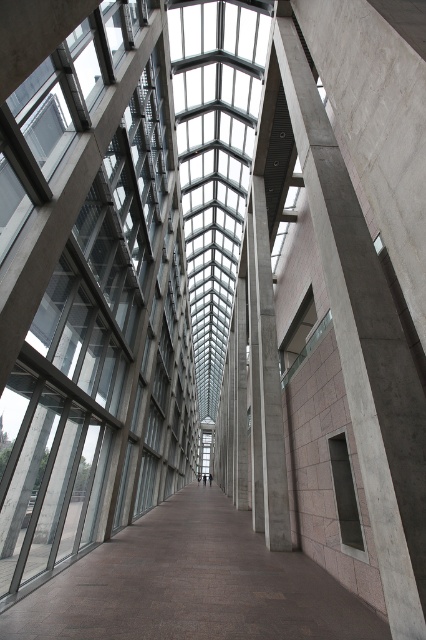
This screenshot has height=640, width=426. What do you see at coordinates (192, 584) in the screenshot?
I see `smooth concrete floor at center` at bounding box center [192, 584].

Find the location of a particular element. smooth concrete floor at center is located at coordinates (192, 584).

Locate an element on the screen. smooth concrete floor at center is located at coordinates (192, 584).